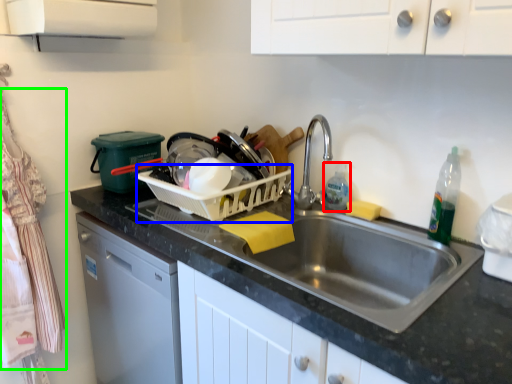
Question: Which object is the closest to the cleaning product (highlighted by a red box)? Choose among these: basket (highlighted by a blue box) or laundry (highlighted by a green box).

Choices:
 (A) basket
 (B) laundry

Answer: (A)